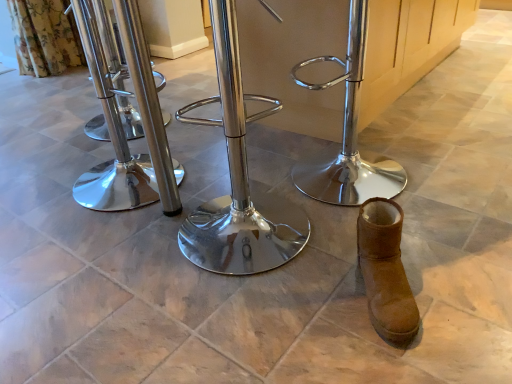
Where is `blank space to the left of polished metal swivel chair at center, which appears as the 3th swivel chair when viewed from the left`? The height and width of the screenshot is (384, 512). blank space to the left of polished metal swivel chair at center, which appears as the 3th swivel chair when viewed from the left is located at coordinates (251, 172).